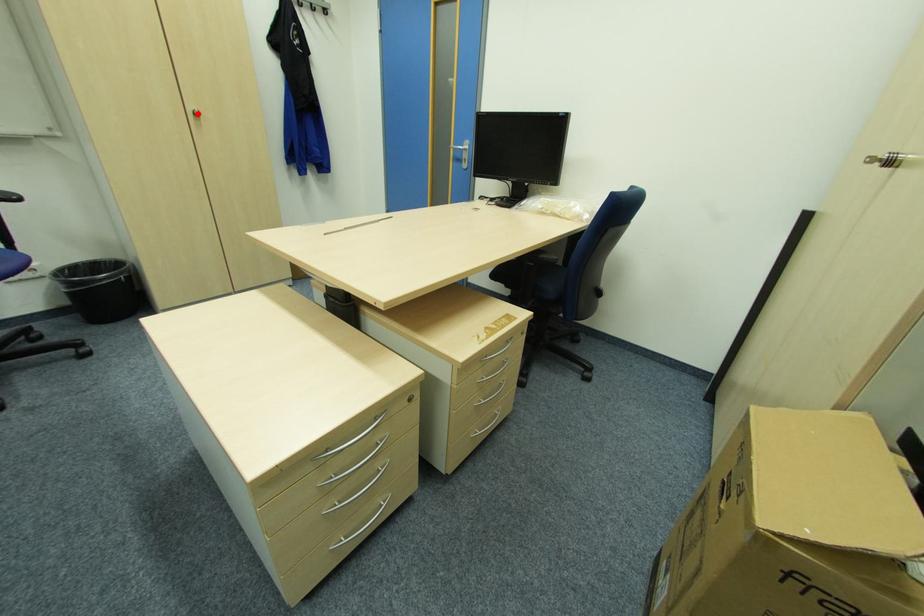
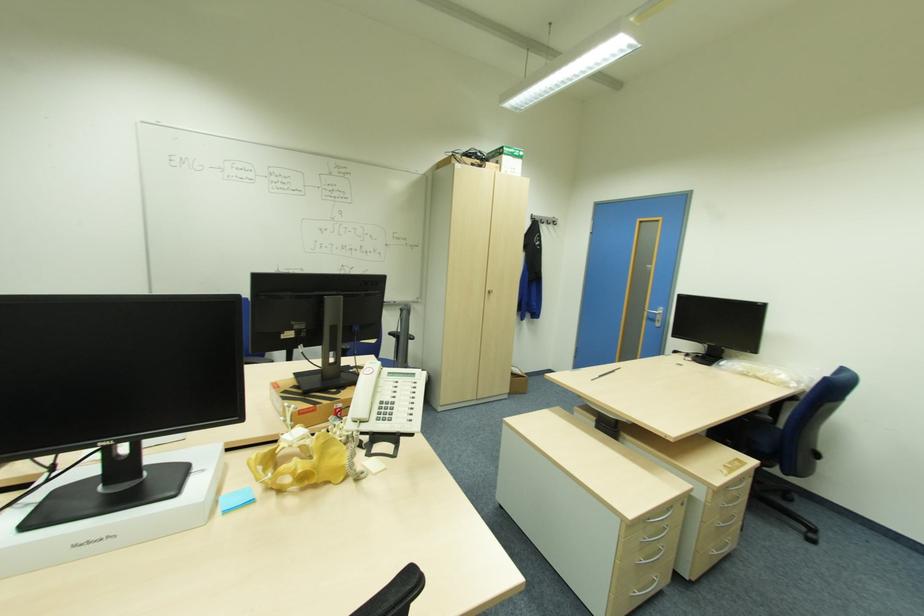
In the second image, find the point that corresponds to the highlighted location in the first image.

(492, 292)